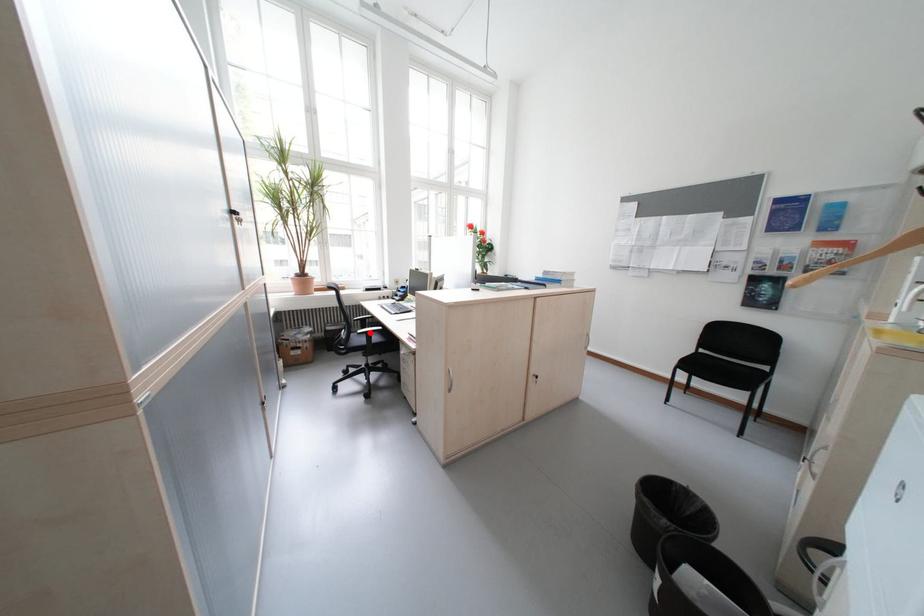
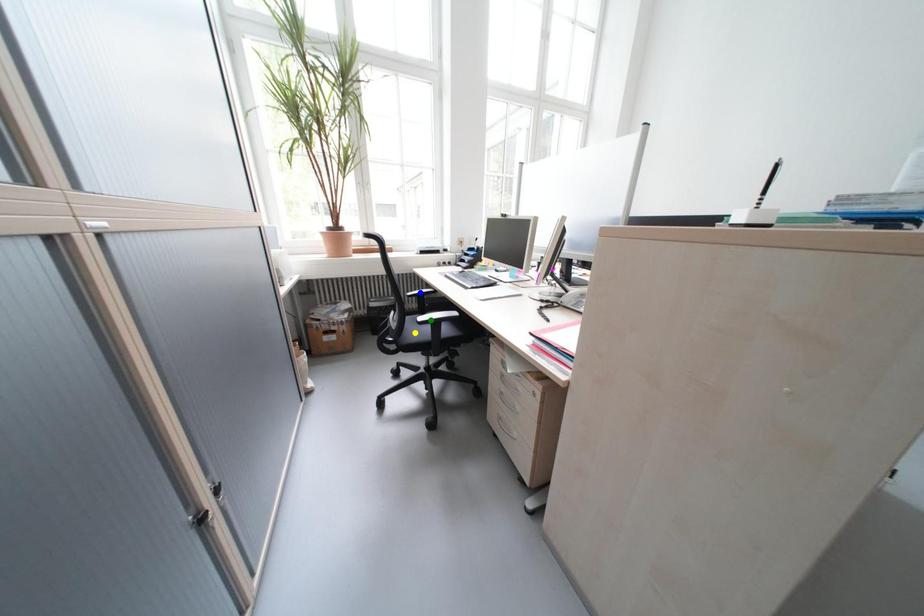
Question: I am providing you with two images of the same scene from different viewpoints. A red point is marked on the first image. You are given multiple points on the second image. In image 2, which mark is for the same physical point as the one in image 1?

Choices:
 (A) blue point
 (B) yellow point
 (C) green point

Answer: (C)